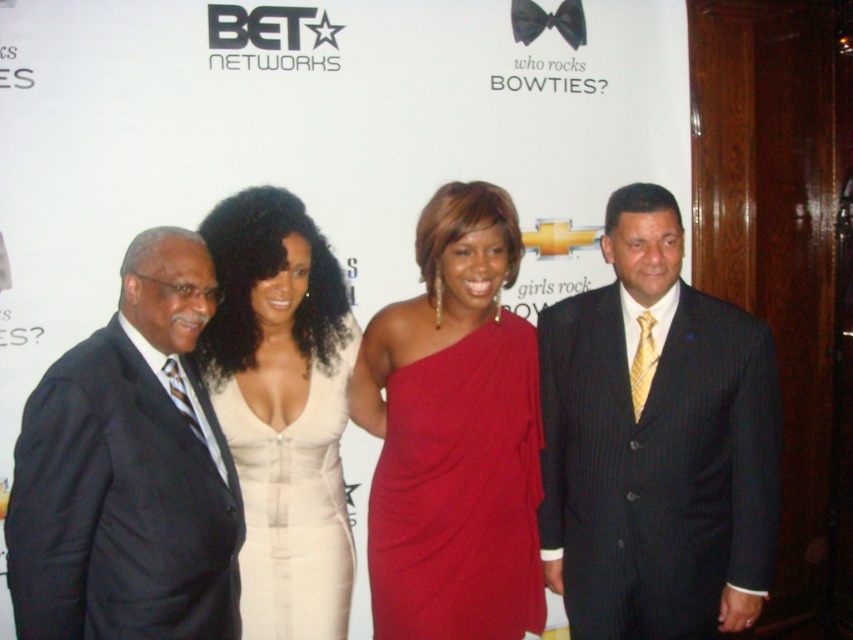
You are a photographer at the event and need to adjust the lighting so that the dark blue suit at left and the white satin dress at center are both well lit. Considering their heights, which object should you adjust the lighting for first to ensure proper exposure?

The dark blue suit at left should be adjusted first since it has a greater height compared to the white satin dress at center, meaning it may require more focused lighting to ensure proper exposure.

You are a photographer at the event and need to adjust the lighting to ensure both the dark blue pinstripe suit at center and the satin red dress at center are well lit. Given their sizes, which one might require more focused lighting to cover its entire area?

The dark blue pinstripe suit at center has a larger width than the satin red dress at center, so it would require more focused lighting to cover its entire area.

Consider the image. You are standing in front of the BET event backdrop and want to take a photo with the dark blue pinstripe suit at center and the satin red dress at center. Which of the two is closer to you?

The dark blue pinstripe suit at center is closer to you since it is further to the viewer than the satin red dress at center.